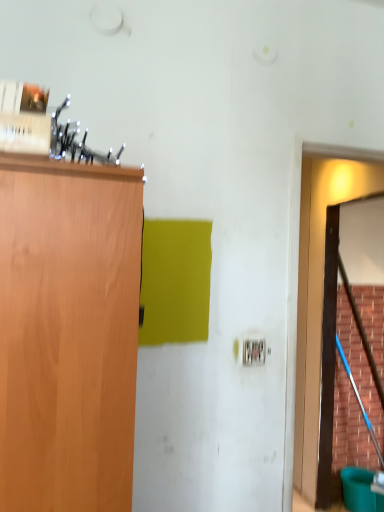
This screenshot has width=384, height=512. What are the coordinates of `brown wooden door at right` in the screenshot? It's located at (319, 293).

Describe the element at coordinates (319, 293) in the screenshot. I see `brown wooden door at right` at that location.

What do you see at coordinates (349, 426) in the screenshot?
I see `smooth wooden broom at right` at bounding box center [349, 426].

What is the approximate width of smooth wooden broom at right?

smooth wooden broom at right is 3.63 inches in width.

Where is `smooth wooden broom at right`? The height and width of the screenshot is (512, 384). smooth wooden broom at right is located at coordinates (349, 426).

At what (x,y) coordinates should I click in order to perform the action: click on brown wooden door at right. Please return your answer as a coordinate pair (x, y). The image size is (384, 512). Looking at the image, I should click on (319, 293).

Between smooth wooden broom at right and brown wooden door at right, which one appears on the left side from the viewer's perspective?

From the viewer's perspective, brown wooden door at right appears more on the left side.

Between smooth wooden broom at right and brown wooden door at right, which one is positioned in front?

brown wooden door at right is closer to the camera.

Which is in front, point (357, 431) or point (308, 257)?

The point (308, 257) is in front.

From the image's perspective, is smooth wooden broom at right below brown wooden door at right?

Indeed, from the image's perspective, smooth wooden broom at right is shown beneath brown wooden door at right.

From a real-world perspective, which object stands above the other?

From a 3D spatial view, brown wooden door at right is above.

Is smooth wooden broom at right wider or thinner than brown wooden door at right?

smooth wooden broom at right is thinner than brown wooden door at right.

Considering the sizes of objects smooth wooden broom at right and brown wooden door at right in the image provided, who is taller, smooth wooden broom at right or brown wooden door at right?

smooth wooden broom at right is taller.

Is smooth wooden broom at right bigger than brown wooden door at right?

No, smooth wooden broom at right is not bigger than brown wooden door at right.

Could brown wooden door at right be considered to be inside smooth wooden broom at right?

No, brown wooden door at right is not surrounded by smooth wooden broom at right.

Would you say smooth wooden broom at right is a long distance from brown wooden door at right?

smooth wooden broom at right is near brown wooden door at right, not far away.

Is smooth wooden broom at right positioned with its back to brown wooden door at right?

No, smooth wooden broom at right is not facing away from brown wooden door at right.

What's the angular difference between smooth wooden broom at right and brown wooden door at right's facing directions?

The facing directions of smooth wooden broom at right and brown wooden door at right are 91.9 degrees apart.

Consider the image. How much distance is there between smooth wooden broom at right and brown wooden door at right?

smooth wooden broom at right and brown wooden door at right are 15.22 inches apart.

You are a GUI agent. You are given a task and a screenshot of the screen. Output one action in this format:
    pyautogui.click(x=<x>, y=<y>)
    Task: Click on the door on the left of smooth wooden broom at right
    The width and height of the screenshot is (384, 512).
    Given the screenshot: What is the action you would take?
    pyautogui.click(x=319, y=293)

Which is more to the left, brown wooden door at right or smooth wooden broom at right?

Positioned to the left is brown wooden door at right.

Is brown wooden door at right in front of or behind smooth wooden broom at right in the image?

brown wooden door at right is positioned closer to the viewer than smooth wooden broom at right.

Which is closer, (305,204) or (346,325)?

→ Point (305,204) is positioned farther from the camera compared to point (346,325).

From the image's perspective, which is above, brown wooden door at right or smooth wooden broom at right?

brown wooden door at right appears higher in the image.

From a real-world perspective, between brown wooden door at right and smooth wooden broom at right, who is vertically higher?

In real-world perspective, brown wooden door at right is above.

Between brown wooden door at right and smooth wooden broom at right, which one has smaller width?

With smaller width is smooth wooden broom at right.

Between brown wooden door at right and smooth wooden broom at right, which one has more height?

smooth wooden broom at right.

Considering the sizes of objects brown wooden door at right and smooth wooden broom at right in the image provided, who is smaller, brown wooden door at right or smooth wooden broom at right?

Smaller between the two is smooth wooden broom at right.

Is smooth wooden broom at right completely or partially inside brown wooden door at right?

No, smooth wooden broom at right is not inside brown wooden door at right.

Are brown wooden door at right and smooth wooden broom at right located far from each other?

No, brown wooden door at right is not far away from smooth wooden broom at right.

Does brown wooden door at right turn towards smooth wooden broom at right?

No.

How much distance is there between brown wooden door at right and smooth wooden broom at right?

38.65 centimeters.

You are a GUI agent. You are given a task and a screenshot of the screen. Output one action in this format:
    pyautogui.click(x=<x>, y=<y>)
    Task: Click on the plywood below the brown wooden door at right (from a real-world perspective)
    Image resolution: width=384 pixels, height=512 pixels.
    Given the screenshot: What is the action you would take?
    pyautogui.click(x=349, y=426)

Image resolution: width=384 pixels, height=512 pixels. Identify the location of plywood to the right of brown wooden door at right. (349, 426).

Where is `plywood behind the brown wooden door at right`? plywood behind the brown wooden door at right is located at coordinates [349, 426].